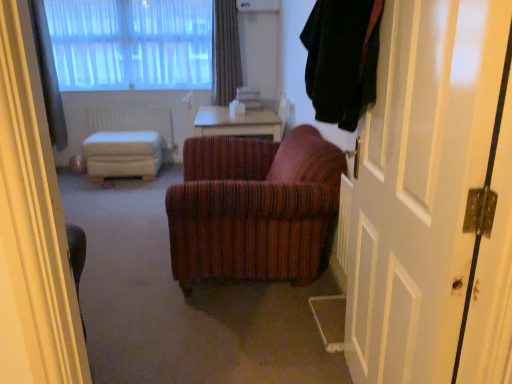
Question: Would you say white plastic radiator at center is to the left or to the right of white wooden door at right in the picture?

Choices:
 (A) left
 (B) right

Answer: (A)

Question: From the image's perspective, is white plastic radiator at center located above or below white wooden door at right?

Choices:
 (A) below
 (B) above

Answer: (B)

Question: Which of these objects is positioned farthest from the white sheer curtain at upper left, positioned as the 2th curtain in right-to-left order?

Choices:
 (A) wooden table at center
 (B) dark green fuzzy robe at upper right
 (C) gray textured curtain at upper center, which is the first curtain in right-to-left order
 (D) white plastic radiator at center
 (E) white wooden door at right

Answer: (E)

Question: Which object is the closest to the white wooden door at right?

Choices:
 (A) white plastic radiator at center
 (B) white sheer curtains at upper left
 (C) gray textured curtain at upper center, which is counted as the 2th curtain, starting from the left
 (D) white wooden stool at center
 (E) white sheer curtain at upper left, which is the 1th curtain in left-to-right order

Answer: (D)